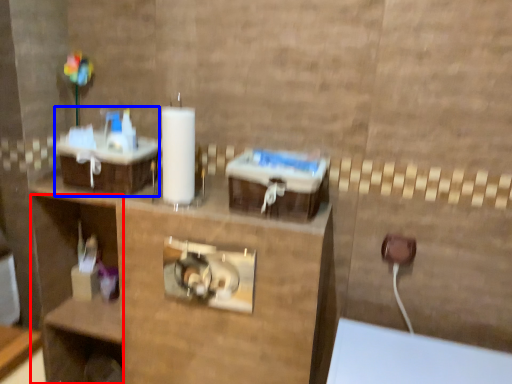
Question: Which object is closer to the camera taking this photo, shelf (highlighted by a red box) or sink (highlighted by a blue box)?

Choices:
 (A) shelf
 (B) sink

Answer: (B)